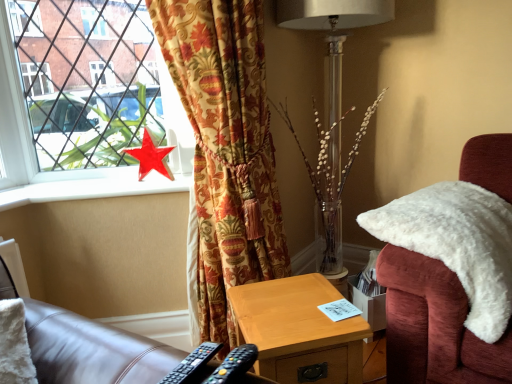
Question: From the image's perspective, does velvet floral curtain at left appear higher than black plastic remote control at lower center, arranged as the first remote control when viewed from the right?

Choices:
 (A) no
 (B) yes

Answer: (B)

Question: Is velvet floral curtain at left not near black plastic remote control at lower center, arranged as the first remote control when viewed from the right?

Choices:
 (A) yes
 (B) no

Answer: (B)

Question: Does velvet floral curtain at left appear on the left side of black plastic remote control at lower center, arranged as the first remote control when viewed from the right?

Choices:
 (A) no
 (B) yes

Answer: (B)

Question: Does velvet floral curtain at left have a greater height compared to black plastic remote control at lower center, which appears as the 2th remote control when viewed from the left?

Choices:
 (A) yes
 (B) no

Answer: (A)

Question: Can you confirm if velvet floral curtain at left is wider than black plastic remote control at lower center, which appears as the 2th remote control when viewed from the left?

Choices:
 (A) no
 (B) yes

Answer: (B)

Question: Is white fluffy chair at right taller or shorter than red glossy star at window?

Choices:
 (A) short
 (B) tall

Answer: (B)

Question: Based on their sizes in the image, would you say white fluffy chair at right is bigger or smaller than red glossy star at window?

Choices:
 (A) big
 (B) small

Answer: (A)

Question: Is white fluffy chair at right spatially inside red glossy star at window, or outside of it?

Choices:
 (A) inside
 (B) outside

Answer: (B)

Question: From the image's perspective, relative to red glossy star at window, is white fluffy chair at right above or below?

Choices:
 (A) above
 (B) below

Answer: (B)

Question: Considering the positions of point (433, 365) and point (219, 374), is point (433, 365) closer or farther from the camera than point (219, 374)?

Choices:
 (A) farther
 (B) closer

Answer: (A)

Question: Would you say white fluffy chair at right is to the left or to the right of black plastic remote control at lower center, arranged as the first remote control when viewed from the right, in the picture?

Choices:
 (A) left
 (B) right

Answer: (B)

Question: From a real-world perspective, is white fluffy chair at right positioned above or below black plastic remote control at lower center, arranged as the first remote control when viewed from the right?

Choices:
 (A) below
 (B) above

Answer: (A)

Question: Considering the positions of white fluffy chair at right and black plastic remote control at lower center, arranged as the first remote control when viewed from the right, in the image, is white fluffy chair at right wider or thinner than black plastic remote control at lower center, arranged as the first remote control when viewed from the right,?

Choices:
 (A) wide
 (B) thin

Answer: (A)

Question: In terms of width, does black plastic remote control at lower center, the first remote control in the left-to-right sequence, look wider or thinner when compared to wooden nightstand at lower center?

Choices:
 (A) thin
 (B) wide

Answer: (A)

Question: Is black plastic remote control at lower center, the first remote control in the left-to-right sequence, taller or shorter than wooden nightstand at lower center?

Choices:
 (A) short
 (B) tall

Answer: (A)